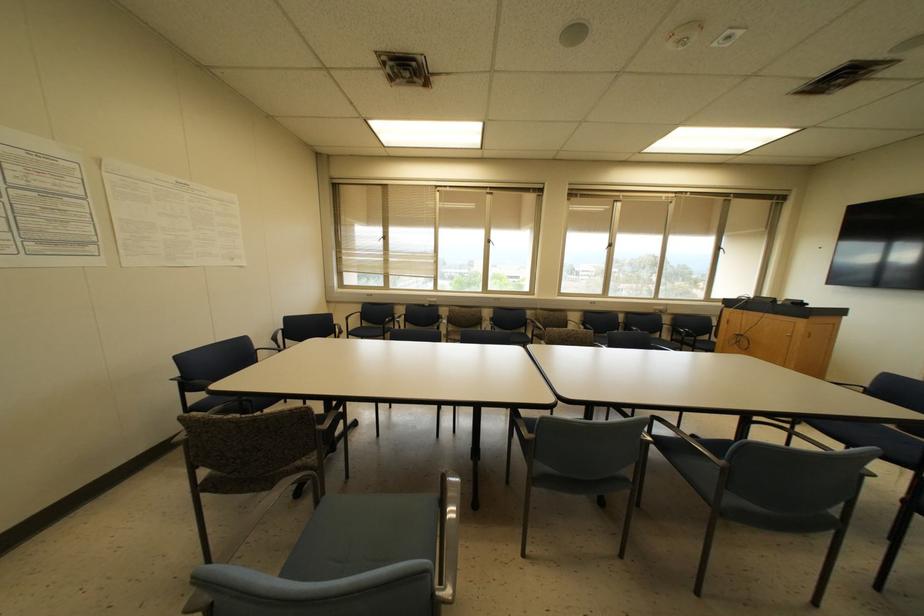
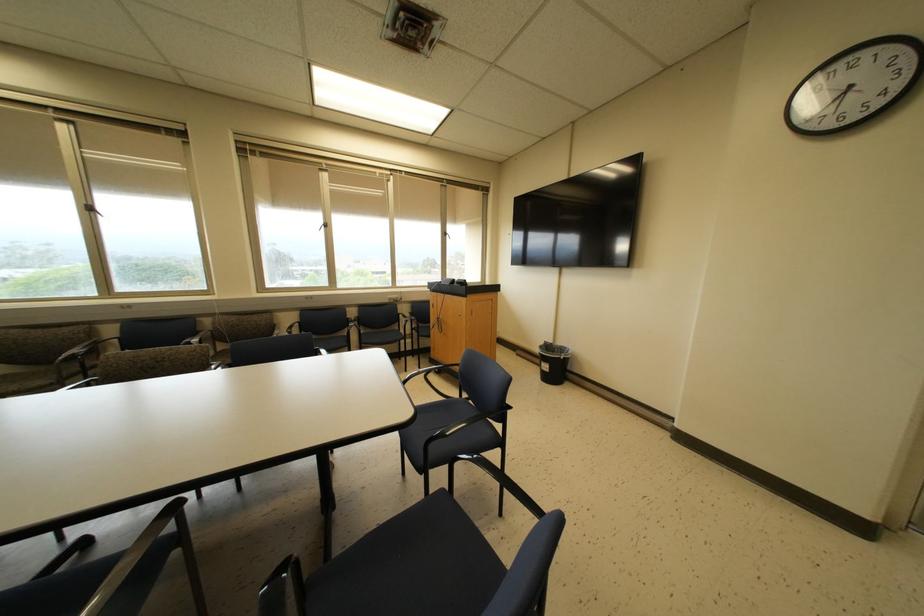
Locate, in the second image, the point that corresponds to the point at 718,248 in the first image.

(444, 233)